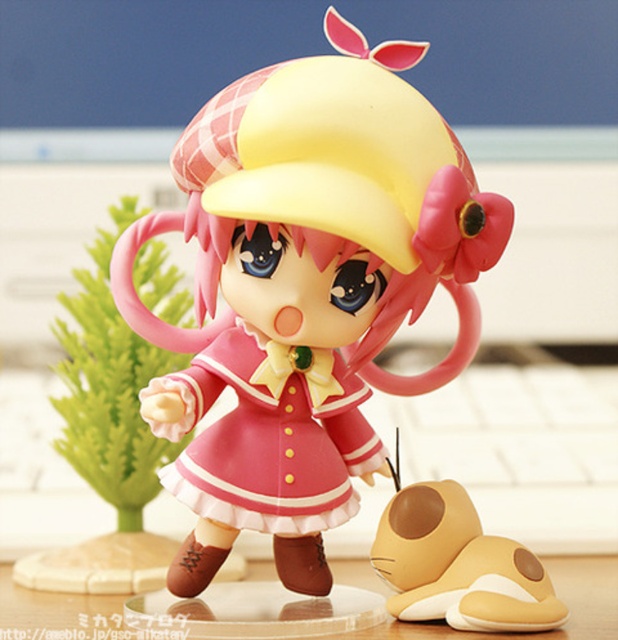
You are organizing a small toy collection and need to place the brown matte plush slippers at lower right and the transparent acrylic table at center on a shelf. Which object should you place first if you want to arrange them from smallest to largest?

The brown matte plush slippers at lower right should be placed first because it is smaller than the transparent acrylic table at center.

Based on the photo, you are trying to place a new accessory on the wooden surface where the pink matte dress at center and transparent acrylic table at center are located. Which object should you place the accessory on to ensure it is visible from above?

The transparent acrylic table at center is larger than the pink matte dress at center, so placing the accessory on the transparent acrylic table at center will make it more visible from above.